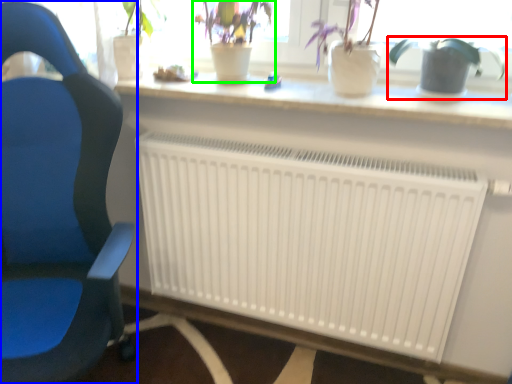
Question: Which object is the farthest from houseplant (highlighted by a red box)? Choose among these: chair (highlighted by a blue box) or houseplant (highlighted by a green box).

Choices:
 (A) chair
 (B) houseplant

Answer: (A)